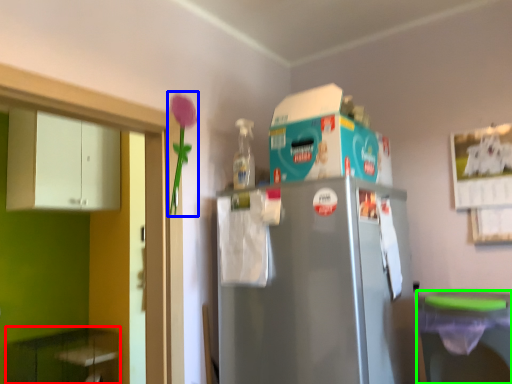
Question: Which object is the farthest from cabinetry (highlighted by a red box)? Choose among these: flower (highlighted by a blue box) or dish washer (highlighted by a green box).

Choices:
 (A) flower
 (B) dish washer

Answer: (B)